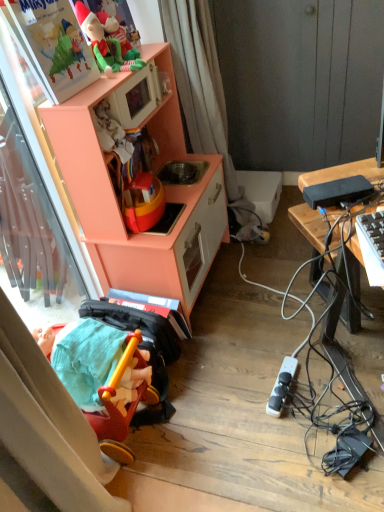
You are a GUI agent. You are given a task and a screenshot of the screen. Output one action in this format:
    pyautogui.click(x=<x>, y=<y>)
    Task: Click on the free point behind black plastic desk at right
    
    Given the screenshot: What is the action you would take?
    pyautogui.click(x=281, y=256)